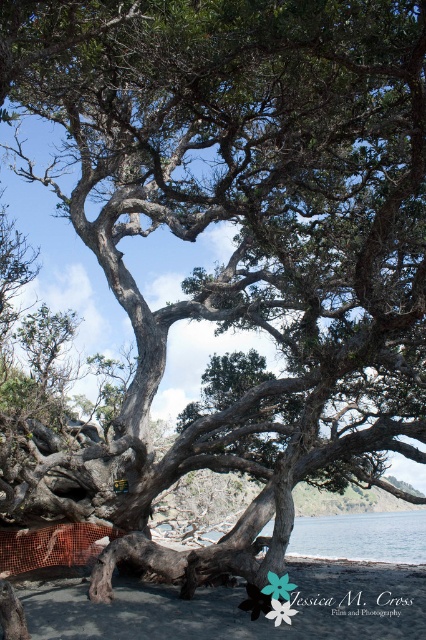
Question: Is smooth sand at lower center to the left of blue water at lower center from the viewer's perspective?

Choices:
 (A) no
 (B) yes

Answer: (B)

Question: Is smooth sand at lower center behind blue water at lower center?

Choices:
 (A) yes
 (B) no

Answer: (B)

Question: Which object is farther from the camera taking this photo?

Choices:
 (A) blue water at lower center
 (B) smooth sand at lower center

Answer: (A)

Question: Is smooth sand at lower center thinner than blue water at lower center?

Choices:
 (A) no
 (B) yes

Answer: (B)